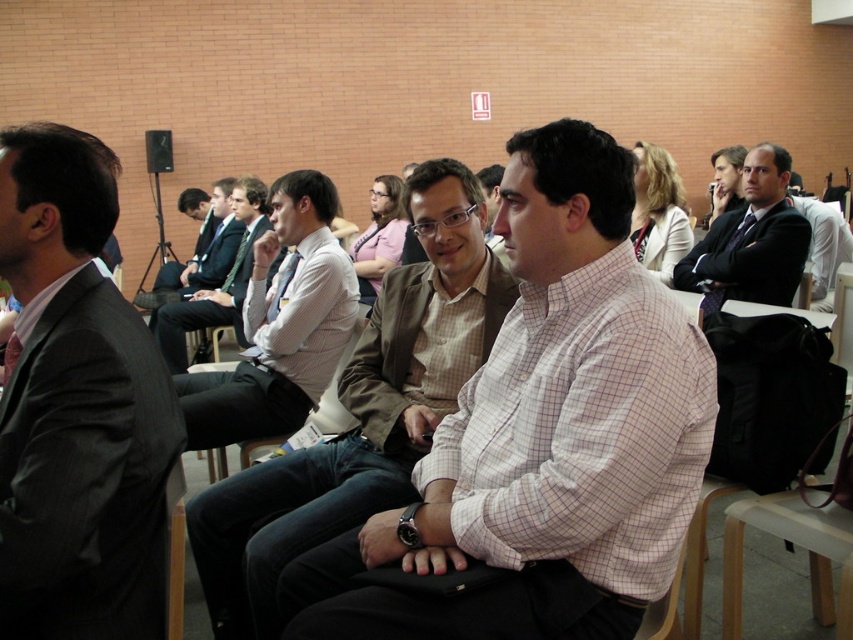
Question: Which of the following is the closest to the observer?

Choices:
 (A) white checkered shirt at center
 (B) white shirt at center
 (C) light brown textured blazer at center
 (D) dark gray suit at left

Answer: (D)

Question: Can you confirm if dark gray suit at left is thinner than light brown textured blazer at center?

Choices:
 (A) no
 (B) yes

Answer: (B)

Question: Is dark gray suit at left bigger than white shirt at center?

Choices:
 (A) no
 (B) yes

Answer: (A)

Question: Which of the following is the farthest from the observer?

Choices:
 (A) dark suit at center
 (B) dark gray suit at left
 (C) white checkered shirt at center
 (D) white shirt at center

Answer: (A)

Question: Which of the following is the closest to the observer?

Choices:
 (A) tap(784, 273)
 (B) tap(491, 636)
 (C) tap(210, 300)
 (D) tap(339, 320)

Answer: (B)

Question: Can you confirm if light brown textured blazer at center is positioned to the right of white shirt at center?

Choices:
 (A) no
 (B) yes

Answer: (B)